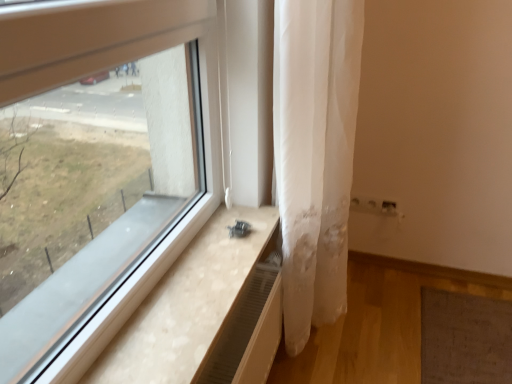
Question: In terms of height, does white sheer curtain at center look taller or shorter compared to light wood/texture window sill at lower left?

Choices:
 (A) tall
 (B) short

Answer: (A)

Question: Is white sheer curtain at center wider or thinner than light wood/texture window sill at lower left?

Choices:
 (A) thin
 (B) wide

Answer: (A)

Question: From a real-world perspective, is white sheer curtain at center physically located above or below light wood/texture window sill at lower left?

Choices:
 (A) below
 (B) above

Answer: (B)

Question: Is point (128, 360) closer or farther from the camera than point (285, 8)?

Choices:
 (A) farther
 (B) closer

Answer: (B)

Question: From the image's perspective, is light wood/texture window sill at lower left above or below white sheer curtain at center?

Choices:
 (A) below
 (B) above

Answer: (A)

Question: Looking at their shapes, would you say light wood/texture window sill at lower left is wider or thinner than white sheer curtain at center?

Choices:
 (A) thin
 (B) wide

Answer: (B)

Question: Based on their positions, is light wood/texture window sill at lower left located to the left or right of white sheer curtain at center?

Choices:
 (A) left
 (B) right

Answer: (A)